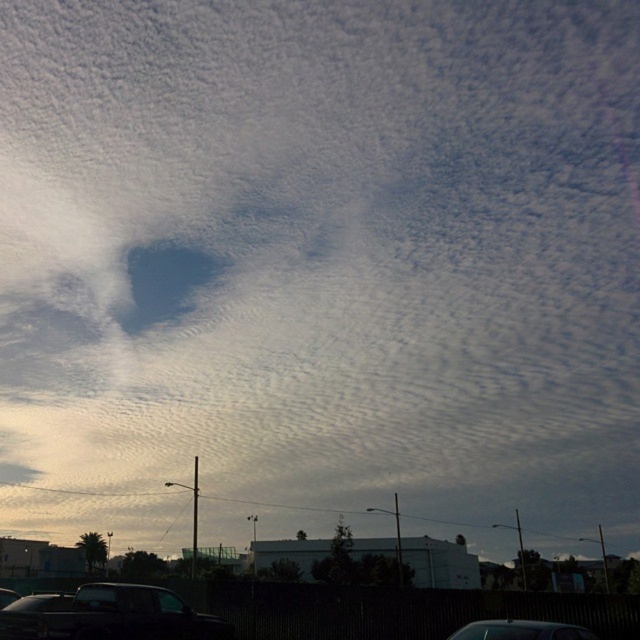
Question: Is dark gray metallic car at lower left behind shiny black car at bottom?

Choices:
 (A) no
 (B) yes

Answer: (B)

Question: Which object appears closest to the camera in this image?

Choices:
 (A) shiny black car at bottom
 (B) dark gray metallic car at lower left

Answer: (A)

Question: Where is dark gray metallic car at lower left located in relation to shiny black car at bottom in the image?

Choices:
 (A) above
 (B) below

Answer: (B)

Question: Does dark gray metallic car at lower left have a larger size compared to shiny black car at bottom?

Choices:
 (A) yes
 (B) no

Answer: (A)

Question: Among these objects, which one is farthest from the camera?

Choices:
 (A) dark gray metallic car at lower left
 (B) shiny black car at bottom

Answer: (A)